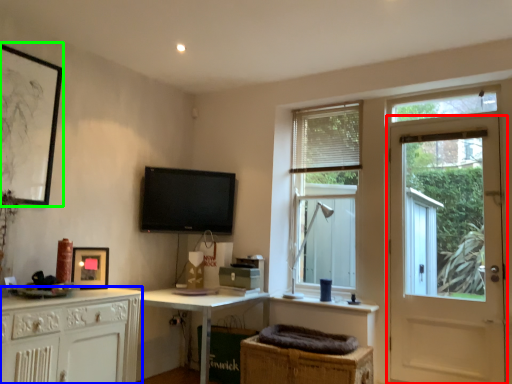
Question: Considering the real-world distances, which object is closest to door (highlighted by a red box)? cabinetry (highlighted by a blue box) or picture frame (highlighted by a green box).

Choices:
 (A) cabinetry
 (B) picture frame

Answer: (A)